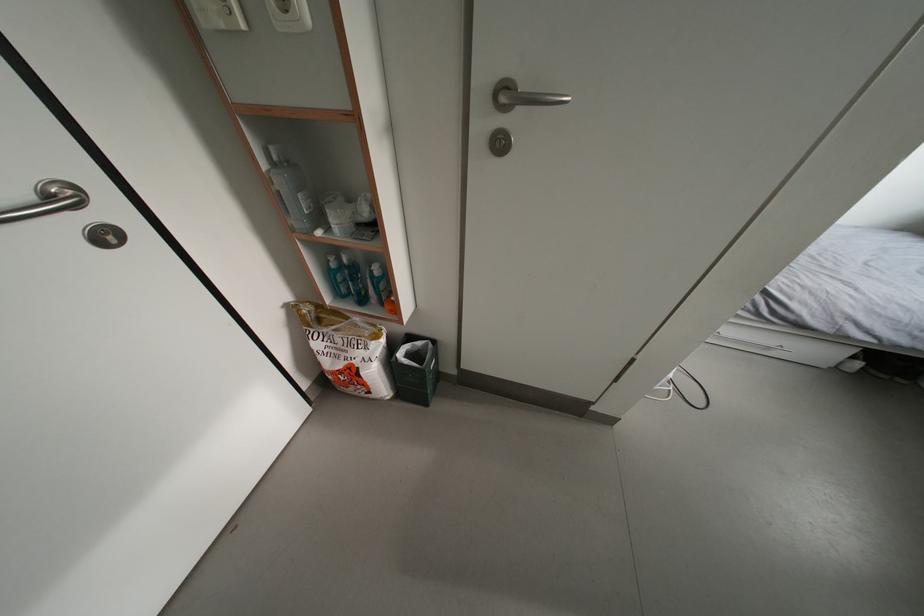
Where is `blue bottle pump`? blue bottle pump is located at coordinates (336, 276).